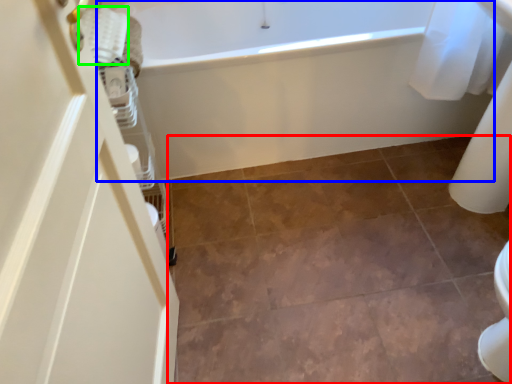
Question: Which is nearer to the ceramic tile (highlighted by a red box)? bathtub (highlighted by a blue box) or material (highlighted by a green box).

Choices:
 (A) bathtub
 (B) material

Answer: (A)